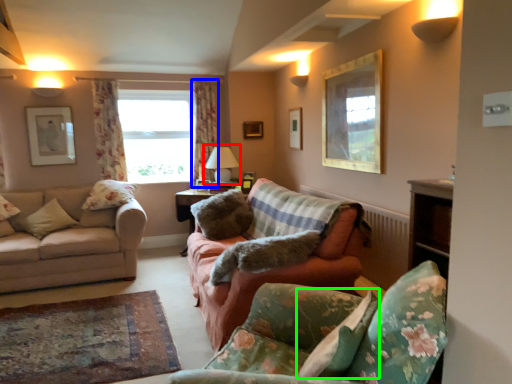
Question: Which object is the farthest from table lamp (highlighted by a red box)? Choose among these: curtain (highlighted by a blue box) or pillow (highlighted by a green box).

Choices:
 (A) curtain
 (B) pillow

Answer: (B)